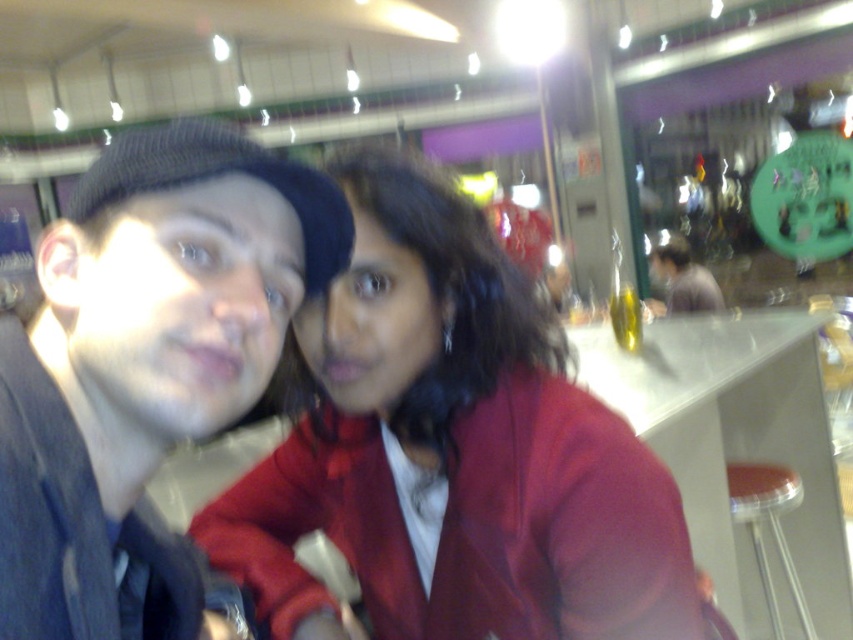
Question: Which object is the farthest from the matte red jacket at center?

Choices:
 (A) matte gray shirt at center
 (B) matte black beanie at upper left

Answer: (A)

Question: Does matte black beanie at upper left have a smaller size compared to transparent plastic stool at lower right?

Choices:
 (A) yes
 (B) no

Answer: (A)

Question: Where is matte red jacket at center located in relation to matte black beanie at upper left in the image?

Choices:
 (A) below
 (B) above

Answer: (A)

Question: Which object appears farthest from the camera in this image?

Choices:
 (A) transparent plastic stool at lower right
 (B) matte black beanie at upper left
 (C) matte gray shirt at center
 (D) matte red jacket at center

Answer: (C)

Question: Which object is closer to the camera taking this photo?

Choices:
 (A) transparent plastic stool at lower right
 (B) matte red jacket at center

Answer: (B)

Question: Can you confirm if matte red jacket at center is positioned to the right of transparent plastic stool at lower right?

Choices:
 (A) no
 (B) yes

Answer: (A)